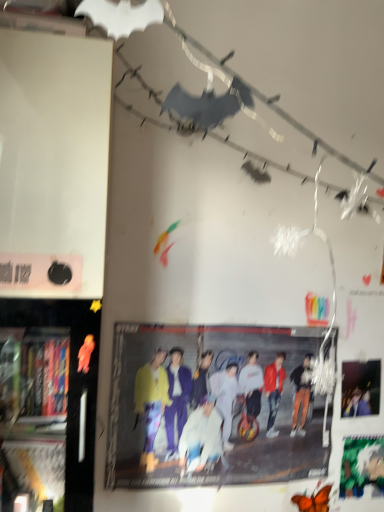
Question: Can you confirm if green matte poster at lower right, which is the first poster page from bottom to top, is bigger than black plastic bookshelf at left?

Choices:
 (A) no
 (B) yes

Answer: (A)

Question: From a real-world perspective, is green matte poster at lower right, arranged as the 2th poster page when viewed from the top, physically below black plastic bookshelf at left?

Choices:
 (A) yes
 (B) no

Answer: (A)

Question: Would you say green matte poster at lower right, arranged as the 2th poster page when viewed from the top, is outside black plastic bookshelf at left?

Choices:
 (A) yes
 (B) no

Answer: (A)

Question: Is green matte poster at lower right, arranged as the 2th poster page when viewed from the top, to the left of black plastic bookshelf at left from the viewer's perspective?

Choices:
 (A) no
 (B) yes

Answer: (A)

Question: Can you confirm if green matte poster at lower right, which is the first poster page from bottom to top, is taller than black plastic bookshelf at left?

Choices:
 (A) yes
 (B) no

Answer: (B)

Question: Is point (359, 476) positioned closer to the camera than point (355, 396)?

Choices:
 (A) farther
 (B) closer

Answer: (A)

Question: In the image, is green matte poster at lower right, arranged as the 2th poster page when viewed from the top, positioned in front of or behind matte black poster at upper right, the first poster page viewed from the top?

Choices:
 (A) behind
 (B) front

Answer: (A)

Question: Considering the positions of green matte poster at lower right, which is the first poster page from bottom to top, and matte black poster at upper right, the first poster page viewed from the top, in the image, is green matte poster at lower right, which is the first poster page from bottom to top, wider or thinner than matte black poster at upper right, the first poster page viewed from the top,?

Choices:
 (A) thin
 (B) wide

Answer: (A)

Question: Would you say green matte poster at lower right, which is the first poster page from bottom to top, is inside or outside matte black poster at upper right, the 2th poster page when ordered from bottom to top?

Choices:
 (A) inside
 (B) outside

Answer: (B)

Question: From a real-world perspective, is matte yellow jacket at center physically located above or below matte black poster at upper right, the 2th poster page when ordered from bottom to top?

Choices:
 (A) below
 (B) above

Answer: (A)

Question: Visually, is matte yellow jacket at center positioned to the left or to the right of matte black poster at upper right, the first poster page viewed from the top?

Choices:
 (A) left
 (B) right

Answer: (A)

Question: Is point (274, 390) closer or farther from the camera than point (344, 394)?

Choices:
 (A) closer
 (B) farther

Answer: (A)

Question: Choose the correct answer: Is matte yellow jacket at center inside matte black poster at upper right, the 2th poster page when ordered from bottom to top, or outside it?

Choices:
 (A) inside
 (B) outside

Answer: (B)

Question: From a real-world perspective, is matte black poster at upper right, the first poster page viewed from the top, positioned above or below matte yellow jacket at center?

Choices:
 (A) below
 (B) above

Answer: (B)

Question: From their relative heights in the image, would you say matte black poster at upper right, the 2th poster page when ordered from bottom to top, is taller or shorter than matte yellow jacket at center?

Choices:
 (A) short
 (B) tall

Answer: (A)